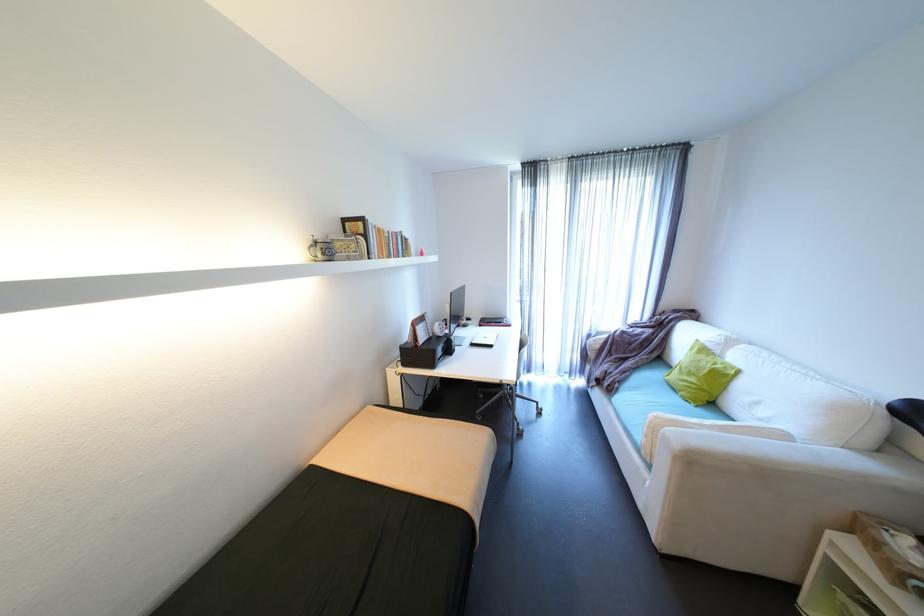
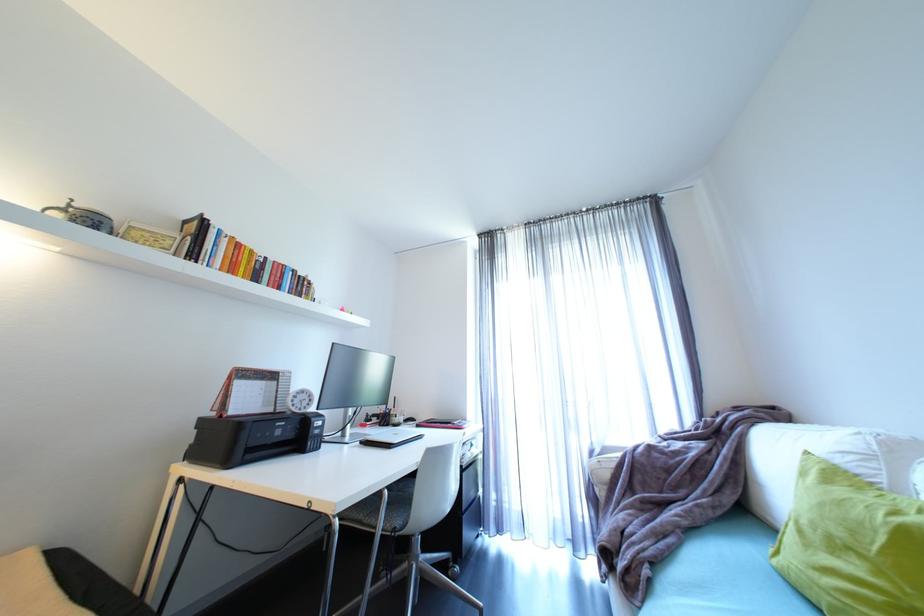
Where in the second image is the point corresponding to [319,243] from the first image?

(69, 206)